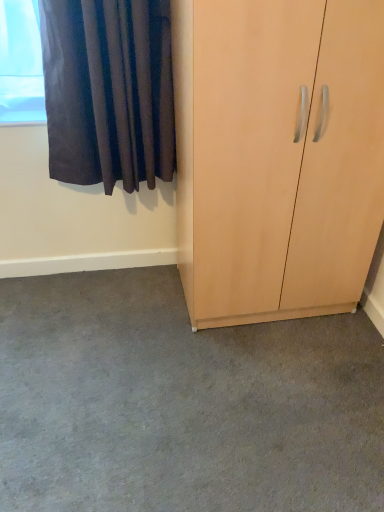
The image size is (384, 512). Identify the location of vacant region above gray carpet at lower center (from a real-world perspective). (184, 385).